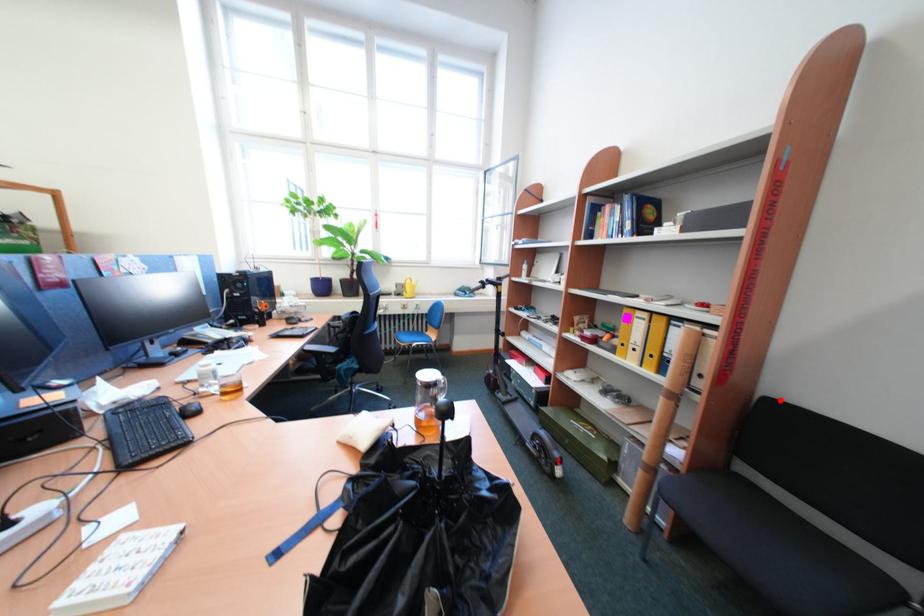
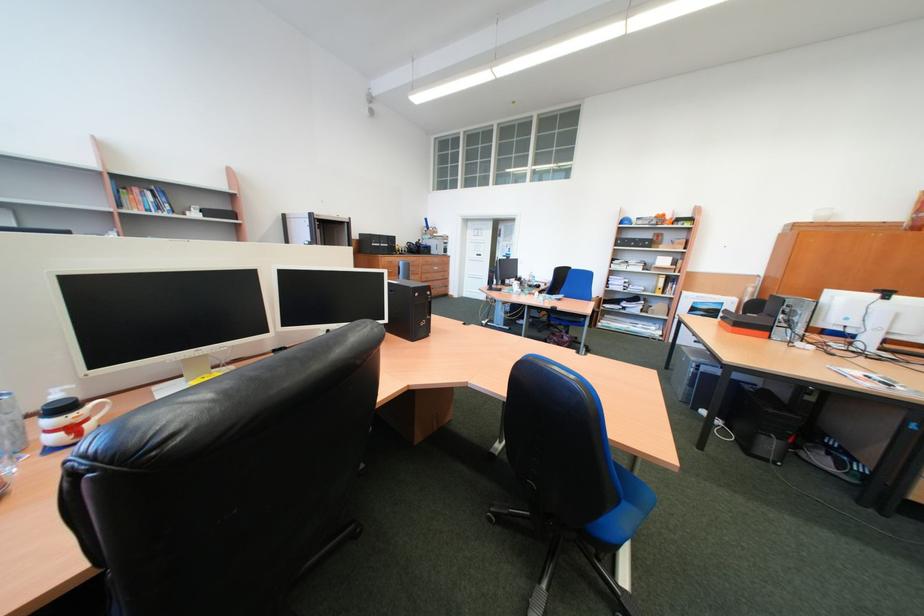
Question: I am providing you with two images of the same scene from different viewpoints. A red point is marked on the first image. Can you still see the location of the red point in image 2?

Choices:
 (A) Yes
 (B) No

Answer: (B)